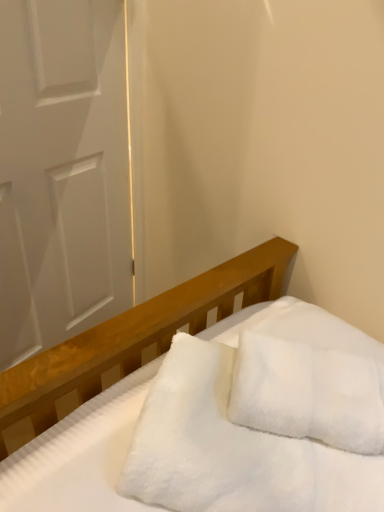
You are a GUI agent. You are given a task and a screenshot of the screen. Output one action in this format:
    pyautogui.click(x=<x>, y=<y>)
    Task: Click on the free point above white fluffy blanket at center (from a real-world perspective)
    
    Given the screenshot: What is the action you would take?
    pyautogui.click(x=261, y=396)